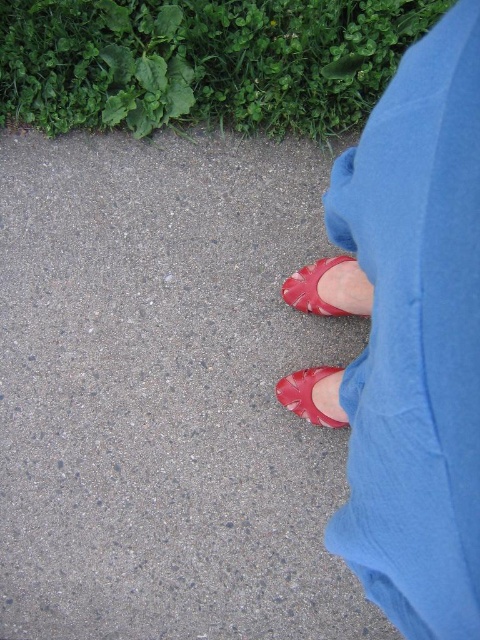
Which is above, smooth concrete pavement at center or matte red shoes at lower center?

matte red shoes at lower center is above.

Does smooth concrete pavement at center appear under matte red shoes at lower center?

Yes, smooth concrete pavement at center is below matte red shoes at lower center.

Between point (222, 285) and point (439, 362), which one is positioned in front?

Point (439, 362) is more forward.

This screenshot has width=480, height=640. I want to click on smooth concrete pavement at center, so pos(165,394).

Between smooth concrete pavement at center and matte leather shoe at lower center, which one has more height?

smooth concrete pavement at center is taller.

Find the location of a particular element. This screenshot has height=640, width=480. smooth concrete pavement at center is located at coordinates (165, 394).

Where is `smooth concrete pavement at center`? The width and height of the screenshot is (480, 640). smooth concrete pavement at center is located at coordinates (165, 394).

Is matte leather shoe at lower center further to the viewer compared to matte red shoe at lower center?

No, it is not.

At what (x,y) coordinates should I click in order to perform the action: click on matte leather shoe at lower center. Please return your answer as a coordinate pair (x, y). Looking at the image, I should click on (330, 289).